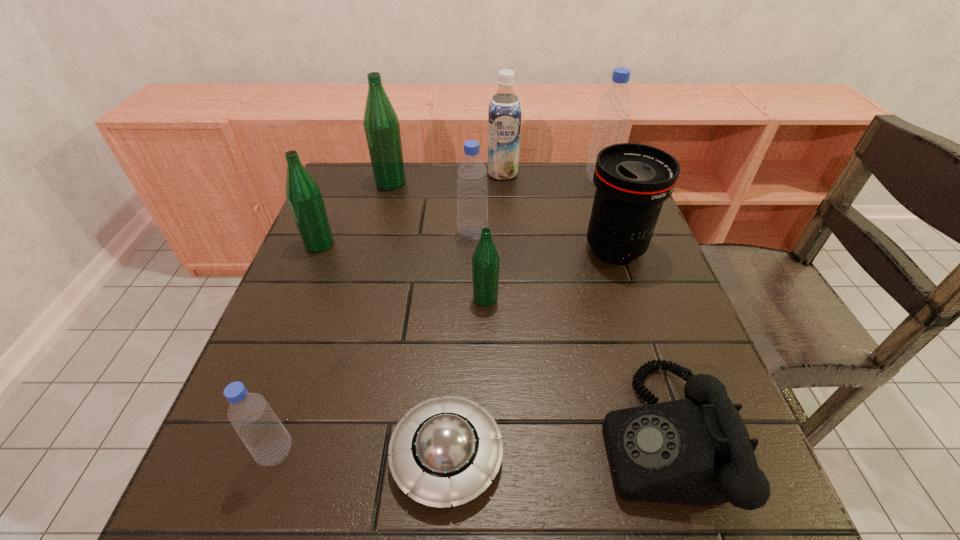
Locate which green bottle ranks second in proximity to the nearest green bottle. Please provide its 2D coordinates. Your answer should be formatted as a tuple, i.e. [(x, y)], where the tuple contains the x and y coordinates of a point satisfying the conditions above.

[(381, 124)]

This screenshot has height=540, width=960. In order to click on vacant area that satisfies the following two spatial constraints: 1. on the label of the soya milk; 2. on the left side of the rightmost bottle in this screenshot , I will do `click(503, 178)`.